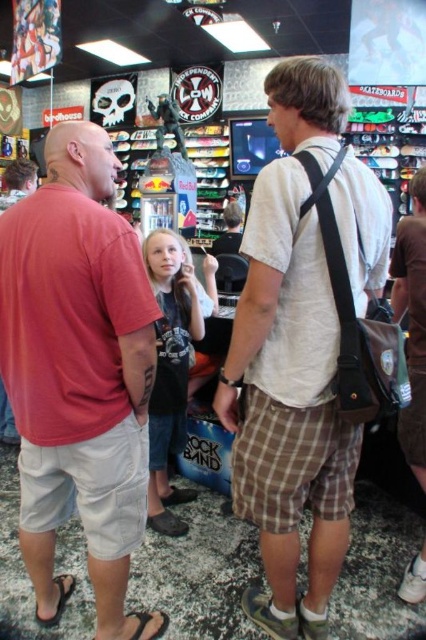
You are standing in a skate shop and want to greet the person wearing the light brown plaid shorts at center. If you take a step forward, will you be closer to them than 4 feet?

The light brown plaid shorts at center and viewer are 4.01 feet apart from each other. If you take a step forward, you will be closer than 4 feet.